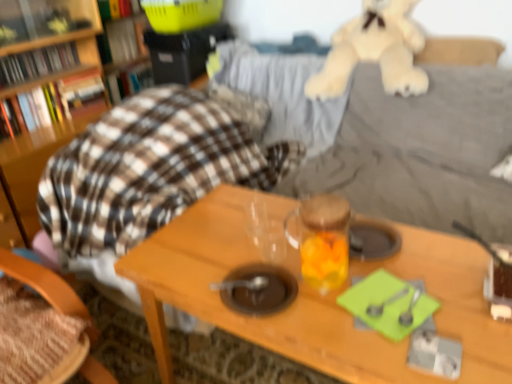
Question: Does transparent glass jar at center have a greater width compared to wooden table at center?

Choices:
 (A) yes
 (B) no

Answer: (B)

Question: Can you confirm if transparent glass jar at center is shorter than wooden table at center?

Choices:
 (A) yes
 (B) no

Answer: (A)

Question: Is the depth of transparent glass jar at center greater than that of wooden table at center?

Choices:
 (A) yes
 (B) no

Answer: (A)

Question: Considering the relative sizes of transparent glass jar at center and wooden table at center in the image provided, is transparent glass jar at center thinner than wooden table at center?

Choices:
 (A) no
 (B) yes

Answer: (B)

Question: From the image's perspective, does transparent glass jar at center appear lower than wooden table at center?

Choices:
 (A) yes
 (B) no

Answer: (B)

Question: Is hardcover book at upper left, the second book ordered from the bottom, in front of or behind hardcover book at upper left, the first book from the top, in the image?

Choices:
 (A) behind
 (B) front

Answer: (A)

Question: From a real-world perspective, is hardcover book at upper left, the 5th book when ordered from top to bottom, above or below hardcover book at upper left, which is the sixth book from bottom to top?

Choices:
 (A) above
 (B) below

Answer: (B)

Question: Considering the positions of hardcover book at upper left, the second book ordered from the bottom, and hardcover book at upper left, the first book from the top, in the image, is hardcover book at upper left, the second book ordered from the bottom, wider or thinner than hardcover book at upper left, the first book from the top,?

Choices:
 (A) wide
 (B) thin

Answer: (B)

Question: Is point (75, 102) positioned closer to the camera than point (108, 8)?

Choices:
 (A) farther
 (B) closer

Answer: (B)

Question: Would you say green plastic toy at upper left, which ranks as the 2th book in top-to-bottom order, is to the left or to the right of wooden table at center in the picture?

Choices:
 (A) right
 (B) left

Answer: (B)

Question: In terms of height, does green plastic toy at upper left, which ranks as the 2th book in top-to-bottom order, look taller or shorter compared to wooden table at center?

Choices:
 (A) tall
 (B) short

Answer: (B)

Question: Considering the positions of green plastic toy at upper left, the fifth book from the bottom, and wooden table at center in the image, is green plastic toy at upper left, the fifth book from the bottom, wider or thinner than wooden table at center?

Choices:
 (A) wide
 (B) thin

Answer: (B)

Question: Considering the positions of point (100, 56) and point (230, 215), is point (100, 56) closer or farther from the camera than point (230, 215)?

Choices:
 (A) farther
 (B) closer

Answer: (A)

Question: Is point (x=329, y=67) positioned closer to the camera than point (x=306, y=210)?

Choices:
 (A) farther
 (B) closer

Answer: (A)

Question: Is soft beige plush at upper right taller or shorter than transparent glass jar at center?

Choices:
 (A) short
 (B) tall

Answer: (B)